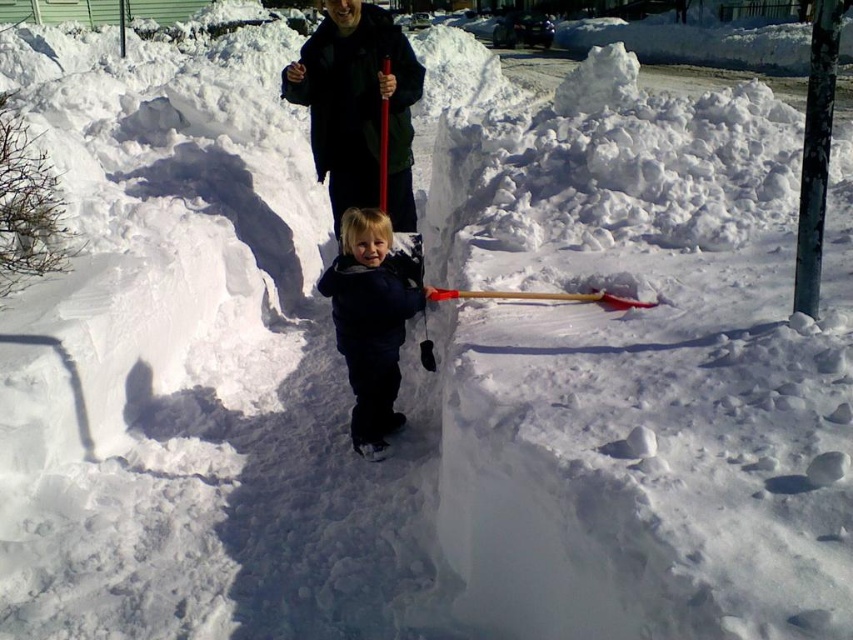
You are a parent looking for your child in a snowy area. You see a dark blue fleece jacket at center and a wooden shovel at center. Which object is taller, indicating where your child might be?

The dark blue fleece jacket at center is much taller than the wooden shovel at center, so the child wearing the jacket is likely near the shovel.

You are a parent trying to locate your child who is wearing a dark blue jacket at center. There is also a smooth gray pole at upper right nearby. Based on the scene description, which object is wider?

The smooth gray pole at upper right is wider than the dark blue jacket at center.

You are a parent trying to decide which item to grab first from the snow. Based on their sizes, which item would be easier to reach and pick up quickly between the dark blue fleece jacket at center and the wooden shovel at center?

The wooden shovel at center is smaller in size than the dark blue fleece jacket at center, so it would be easier to reach and pick up quickly.